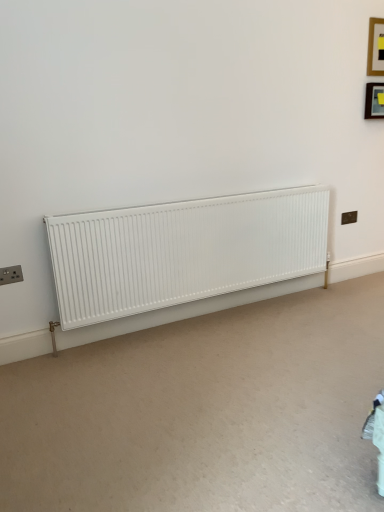
Question: Considering the relative positions of wooden frame at upper right, acting as the first picture frame starting from the top, and matte black socket at lower left, which is the first electric outlet from front to back, in the image provided, is wooden frame at upper right, acting as the first picture frame starting from the top, to the right of matte black socket at lower left, which is the first electric outlet from front to back, from the viewer's perspective?

Choices:
 (A) no
 (B) yes

Answer: (B)

Question: Can you confirm if wooden frame at upper right, acting as the first picture frame starting from the top, is smaller than matte black socket at lower left, which is the first electric outlet from front to back?

Choices:
 (A) yes
 (B) no

Answer: (B)

Question: Can you confirm if wooden frame at upper right, acting as the first picture frame starting from the top, is thinner than matte black socket at lower left, which is counted as the 2th electric outlet, starting from the back?

Choices:
 (A) no
 (B) yes

Answer: (B)

Question: Is wooden frame at upper right, placed as the second picture frame when sorted from bottom to top, further to camera compared to matte black socket at lower left, the first electric outlet from the left?

Choices:
 (A) no
 (B) yes

Answer: (B)

Question: Could you tell me if wooden frame at upper right, acting as the first picture frame starting from the top, is facing matte black socket at lower left, arranged as the 1th electric outlet when ordered from the bottom?

Choices:
 (A) no
 (B) yes

Answer: (A)

Question: Do you think matte black picture frame at upper right, which is counted as the 2th picture frame, starting from the top, is within black plastic electric outlet at upper right, which is counted as the first electric outlet, starting from the right, or outside of it?

Choices:
 (A) outside
 (B) inside

Answer: (A)

Question: From a real-world perspective, is matte black picture frame at upper right, which is counted as the 2th picture frame, starting from the top, positioned above or below black plastic electric outlet at upper right, positioned as the first electric outlet in top-to-bottom order?

Choices:
 (A) below
 (B) above

Answer: (B)

Question: Is point (375, 104) closer or farther from the camera than point (349, 221)?

Choices:
 (A) farther
 (B) closer

Answer: (B)

Question: From the image's perspective, relative to black plastic electric outlet at upper right, marked as the 1th electric outlet in a back-to-front arrangement, is matte black picture frame at upper right, which is the 1th picture frame in bottom-to-top order, above or below?

Choices:
 (A) above
 (B) below

Answer: (A)

Question: Is matte black socket at lower left, which is the second electric outlet in right-to-left order, situated inside white matte radiator at center or outside?

Choices:
 (A) outside
 (B) inside

Answer: (A)

Question: Looking at their shapes, would you say matte black socket at lower left, the first electric outlet from the left, is wider or thinner than white matte radiator at center?

Choices:
 (A) thin
 (B) wide

Answer: (A)

Question: Relative to white matte radiator at center, is matte black socket at lower left, which is the first electric outlet from front to back, in front or behind?

Choices:
 (A) front
 (B) behind

Answer: (B)

Question: From the image's perspective, relative to white matte radiator at center, is matte black socket at lower left, which is the second electric outlet in top-to-bottom order, above or below?

Choices:
 (A) below
 (B) above

Answer: (A)

Question: From a real-world perspective, is matte black socket at lower left, which is the second electric outlet in top-to-bottom order, positioned above or below black plastic electric outlet at upper right, positioned as the first electric outlet in top-to-bottom order?

Choices:
 (A) above
 (B) below

Answer: (A)

Question: Would you say matte black socket at lower left, arranged as the 1th electric outlet when ordered from the bottom, is inside or outside black plastic electric outlet at upper right, marked as the 1th electric outlet in a back-to-front arrangement?

Choices:
 (A) inside
 (B) outside

Answer: (B)